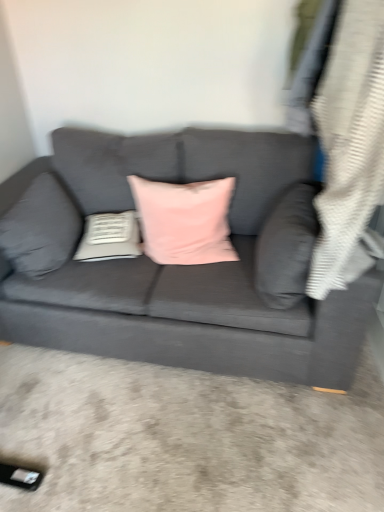
Question: Considering the positions of matte gray pillow at left, the 4th pillow when ordered from right to left, and pink velvet pillow at center, the 3th pillow in the left-to-right sequence, in the image, is matte gray pillow at left, the 4th pillow when ordered from right to left, bigger or smaller than pink velvet pillow at center, the 3th pillow in the left-to-right sequence,?

Choices:
 (A) big
 (B) small

Answer: (B)

Question: Considering the positions of matte gray pillow at left, marked as the 1th pillow in a left-to-right arrangement, and pink velvet pillow at center, which ranks as the second pillow in right-to-left order, in the image, is matte gray pillow at left, marked as the 1th pillow in a left-to-right arrangement, wider or thinner than pink velvet pillow at center, which ranks as the second pillow in right-to-left order,?

Choices:
 (A) thin
 (B) wide

Answer: (A)

Question: Which object is positioned farthest from the pink velvet pillow at center, which ranks as the second pillow in right-to-left order?

Choices:
 (A) white textured pillow at center, the 2th pillow viewed from the left
 (B) matte gray pillow at right, which is counted as the 1th pillow, starting from the right
 (C) matte gray couch at center
 (D) matte gray pillow at left, the 4th pillow when ordered from right to left

Answer: (D)

Question: Which object is positioned closest to the matte gray couch at center?

Choices:
 (A) matte gray pillow at right, which is counted as the 1th pillow, starting from the right
 (B) pink velvet pillow at center, which ranks as the second pillow in right-to-left order
 (C) white textured pillow at center, the 3th pillow viewed from the right
 (D) matte gray pillow at left, the 4th pillow when ordered from right to left

Answer: (B)